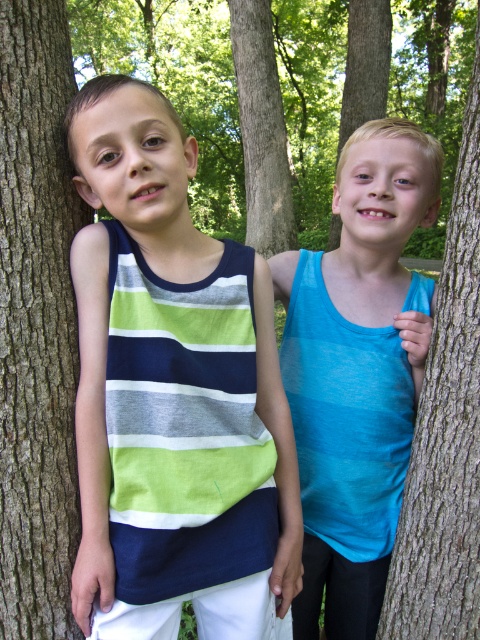
Who is positioned more to the left, brown rough tree trunk at left or brown rough tree trunk at right?

Positioned to the left is brown rough tree trunk at left.

Which of these two, brown rough tree trunk at left or brown rough tree trunk at right, stands shorter?

Standing shorter between the two is brown rough tree trunk at left.

Does point (58, 65) lie behind point (405, 518)?

No.

Locate an element on the screen. The width and height of the screenshot is (480, 640). brown rough tree trunk at left is located at coordinates (36, 323).

Between blue smooth tank top at right and brown rough tree trunk at left, which one has more height?

blue smooth tank top at right

Between blue smooth tank top at right and brown rough tree trunk at left, which one appears on the right side from the viewer's perspective?

blue smooth tank top at right

Does point (376, 380) lie in front of point (38, 84)?

No, (376, 380) is further to viewer.

Where is `blue smooth tank top at right`? The width and height of the screenshot is (480, 640). blue smooth tank top at right is located at coordinates (357, 371).

Is striped cotton tank top at left further to the viewer compared to blue smooth tank top at right?

No, striped cotton tank top at left is in front of blue smooth tank top at right.

The width and height of the screenshot is (480, 640). What do you see at coordinates (172, 396) in the screenshot?
I see `striped cotton tank top at left` at bounding box center [172, 396].

The width and height of the screenshot is (480, 640). Identify the location of striped cotton tank top at left. (172, 396).